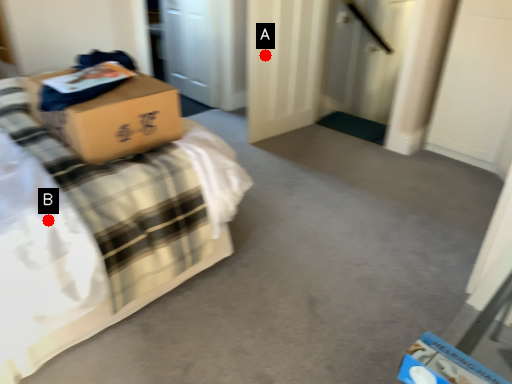
Question: Two points are circled on the image, labeled by A and B beside each circle. Which point is closer to the camera taking this photo?

Choices:
 (A) A is closer
 (B) B is closer

Answer: (B)